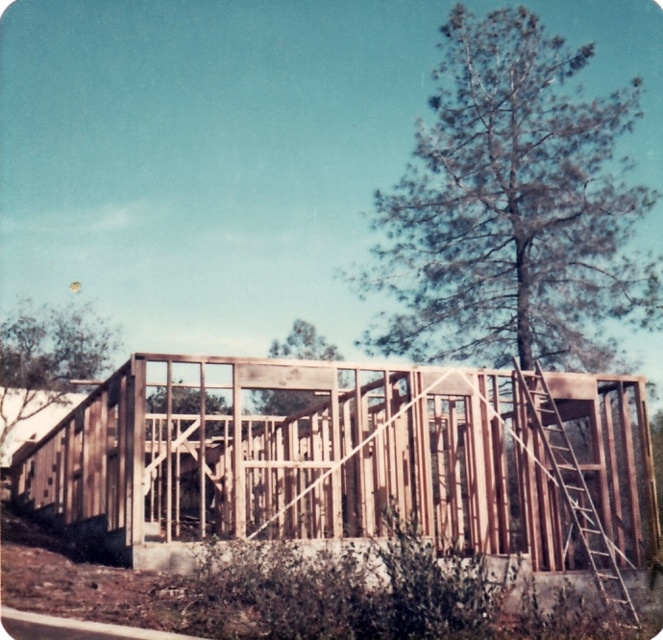
Which is more to the left, wooden at right or green leafy tree at center?

green leafy tree at center

Does wooden at right appear over green leafy tree at center?

Actually, wooden at right is below green leafy tree at center.

Is point (591, 563) farther from camera compared to point (272, 339)?

No, (591, 563) is in front of (272, 339).

The image size is (663, 640). Identify the location of wooden at right. (575, 492).

Who is lower down, green leafy tree at upper center or wooden at right?

wooden at right is lower down.

Can you confirm if green leafy tree at upper center is smaller than wooden at right?

No.

At what (x,y) coordinates should I click in order to perform the action: click on green leafy tree at upper center. Please return your answer as a coordinate pair (x, y). The image size is (663, 640). Looking at the image, I should click on (511, 208).

Based on the photo, who is lower down, green leafy tree at upper left or green leafy tree at center?

green leafy tree at upper left is lower down.

Is green leafy tree at upper left in front of green leafy tree at center?

No, green leafy tree at upper left is further to the viewer.

Is point (17, 387) more distant than point (332, 356)?

No, (17, 387) is in front of (332, 356).

I want to click on green leafy tree at upper left, so (x=52, y=346).